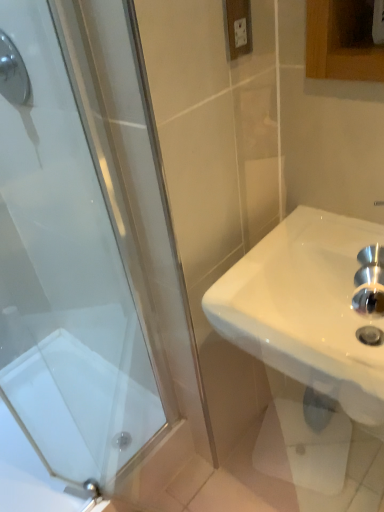
Question: In the image, is white glossy sink at right positioned in front of or behind white plastic electric outlet at upper center?

Choices:
 (A) behind
 (B) front

Answer: (B)

Question: From a real-world perspective, is white glossy sink at right physically located above or below white plastic electric outlet at upper center?

Choices:
 (A) below
 (B) above

Answer: (A)

Question: Estimate the real-world distances between objects in this image. Which object is closer to the white glossy bath at lower left?

Choices:
 (A) white glossy sink at right
 (B) white plastic electric outlet at upper center
 (C) shiny chrome showerhead at upper left

Answer: (A)

Question: Estimate the real-world distances between objects in this image. Which object is farther from the white glossy bath at lower left?

Choices:
 (A) white plastic electric outlet at upper center
 (B) white glossy sink at right
 (C) shiny chrome showerhead at upper left

Answer: (A)